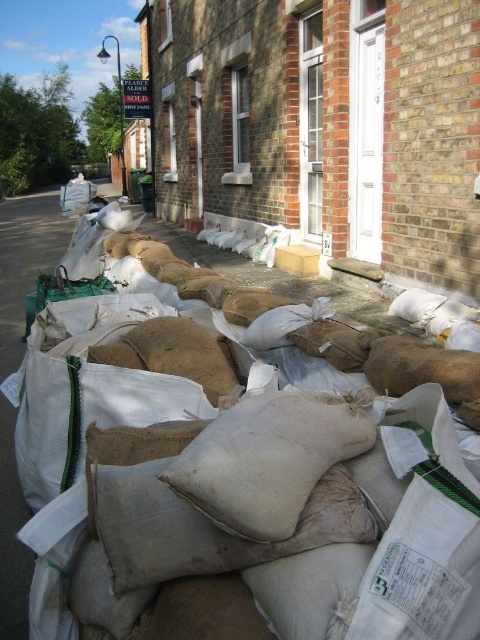
Which of these two, beige fabric pillow at center or burlap sack at center, stands shorter?

beige fabric pillow at center is shorter.

Is beige fabric pillow at center above burlap sack at center?

Incorrect, beige fabric pillow at center is not positioned above burlap sack at center.

You are a GUI agent. You are given a task and a screenshot of the screen. Output one action in this format:
    pyautogui.click(x=<x>, y=<y>)
    Task: Click on the beige fabric pillow at center
    The width and height of the screenshot is (480, 640).
    Given the screenshot: What is the action you would take?
    pyautogui.click(x=204, y=525)